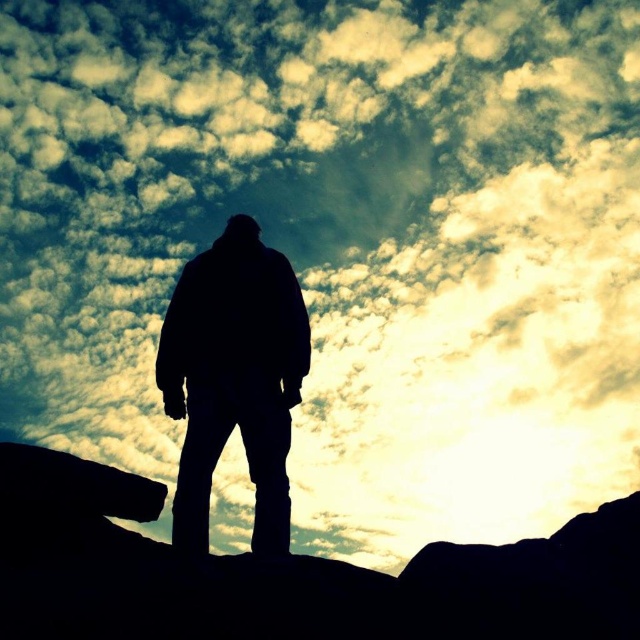
You are a photographer trying to capture the silhouette jacket at center in your shot. You notice the black rock at center is blocking part of the jacket. Can you move the rock to get a clearer view of the jacket?

The black rock at center is closer to the viewer than the silhouette jacket at center, so moving the rock would allow you to see the silhouette jacket at center without obstruction.

You are a photographer trying to capture the silhouette of the jacket and the rock in the scene. Since both are at the center, which one should you adjust your camera focus on first if you want the silhouette jacket at center to be in focus while keeping the black rock at center somewhat in focus?

The black rock at center is positioned on the right side of silhouette jacket at center. To prioritize the silhouette jacket at center in focus, adjust your focus on it first, then slightly adjust towards the black rock at center to maintain its sharpness.